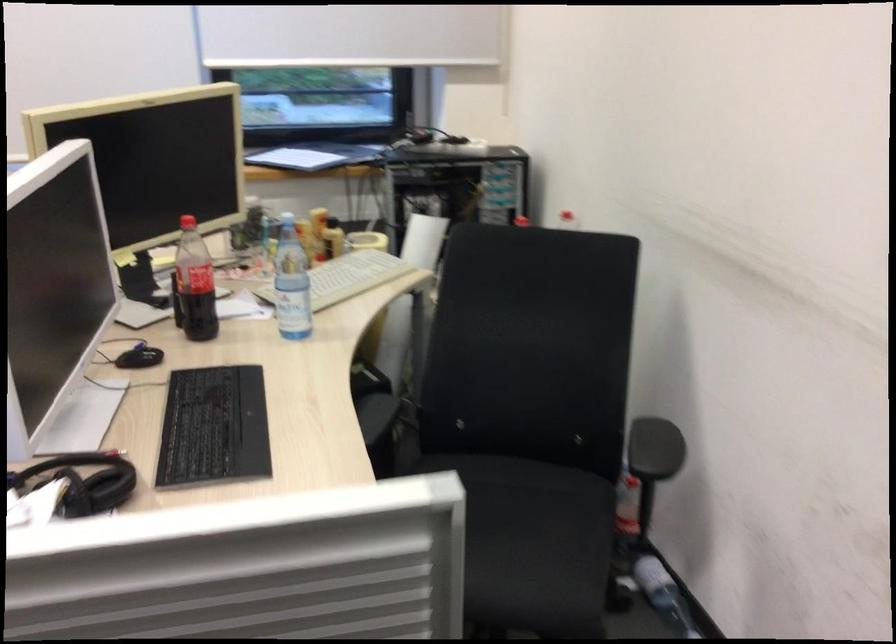
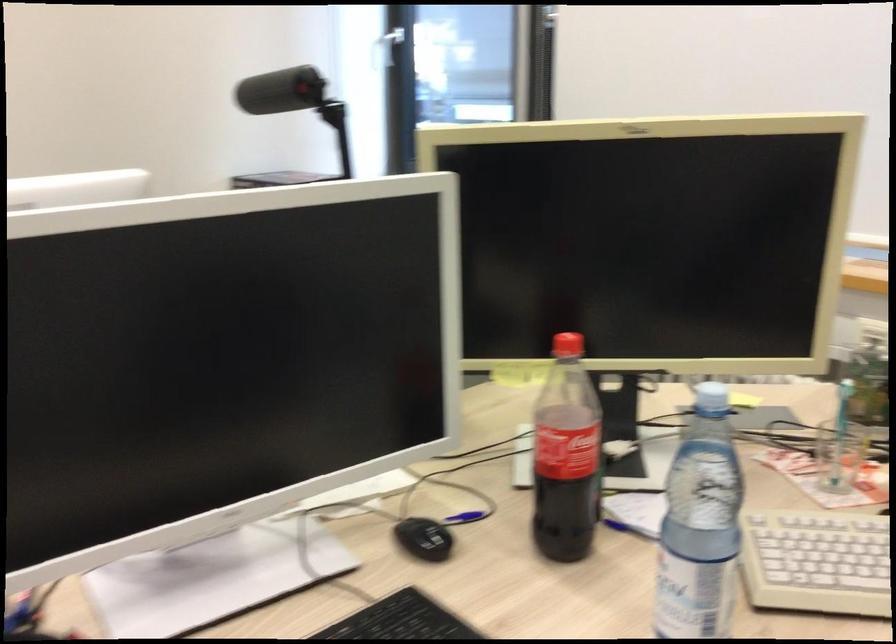
Find the pixel in the second image that matches [297,295] in the first image.

(815, 562)